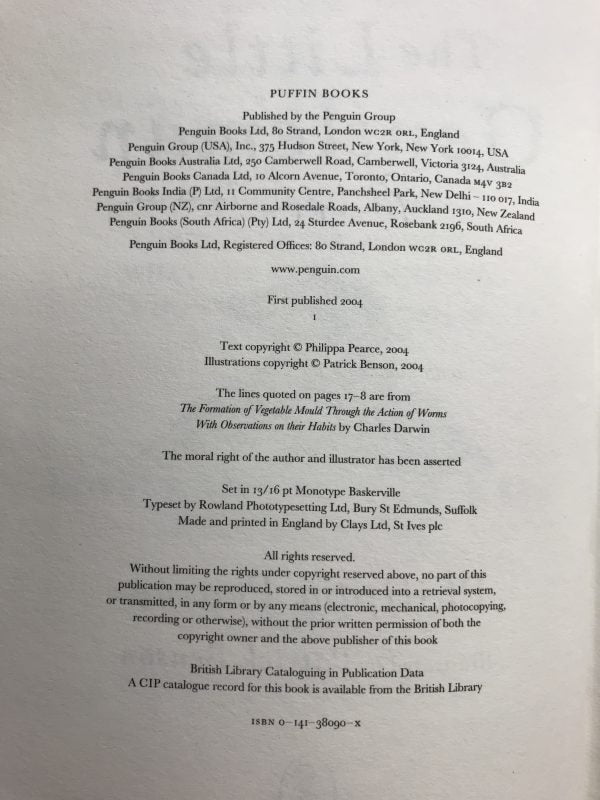
Locate an element on the screen. This screenshot has width=600, height=800. location printer is located at coordinates (266, 514).